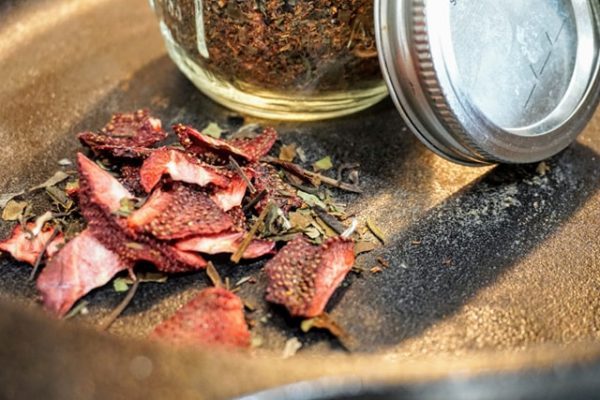
Find the location of a particular element. light reflections on glass jar is located at coordinates (199, 27), (165, 29), (170, 10), (179, 11).